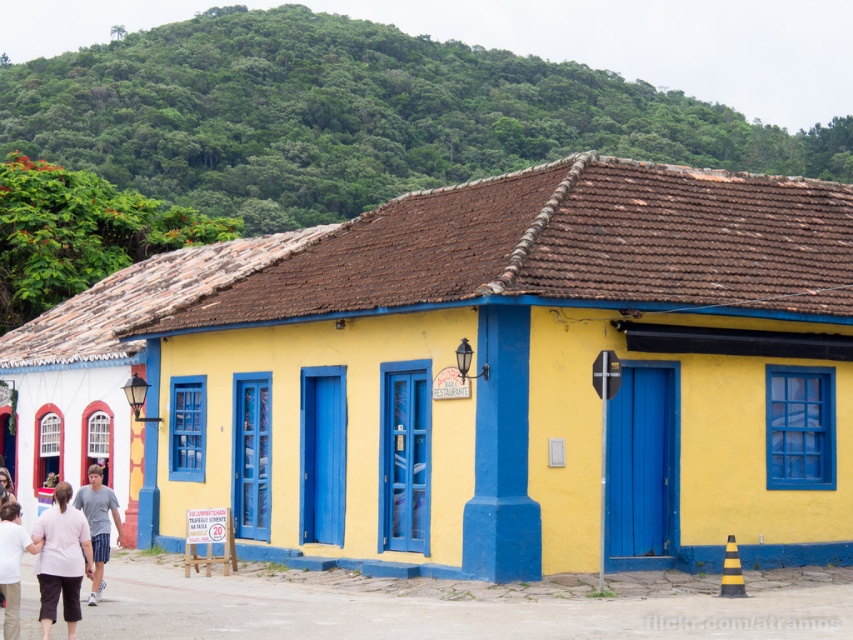
Can you confirm if pink fabric pants at lower left is wider than white cotton shirt at lower left?

Incorrect, pink fabric pants at lower left's width does not surpass white cotton shirt at lower left's.

Which of these two, pink fabric pants at lower left or white cotton shirt at lower left, stands shorter?

pink fabric pants at lower left

Identify the location of pink fabric pants at lower left. This screenshot has width=853, height=640. (61, 560).

Which is in front, point (683, 259) or point (62, 529)?

Point (62, 529) is more forward.

Does yellow matte building at center appear on the right side of pink fabric pants at lower left?

Correct, you'll find yellow matte building at center to the right of pink fabric pants at lower left.

What are the coordinates of `yellow matte building at center` in the screenshot? It's located at (509, 376).

You are a GUI agent. You are given a task and a screenshot of the screen. Output one action in this format:
    pyautogui.click(x=<x>, y=<y>)
    Task: Click on the green leafy hillside at upper center
    
    Given the screenshot: What is the action you would take?
    pyautogui.click(x=355, y=115)